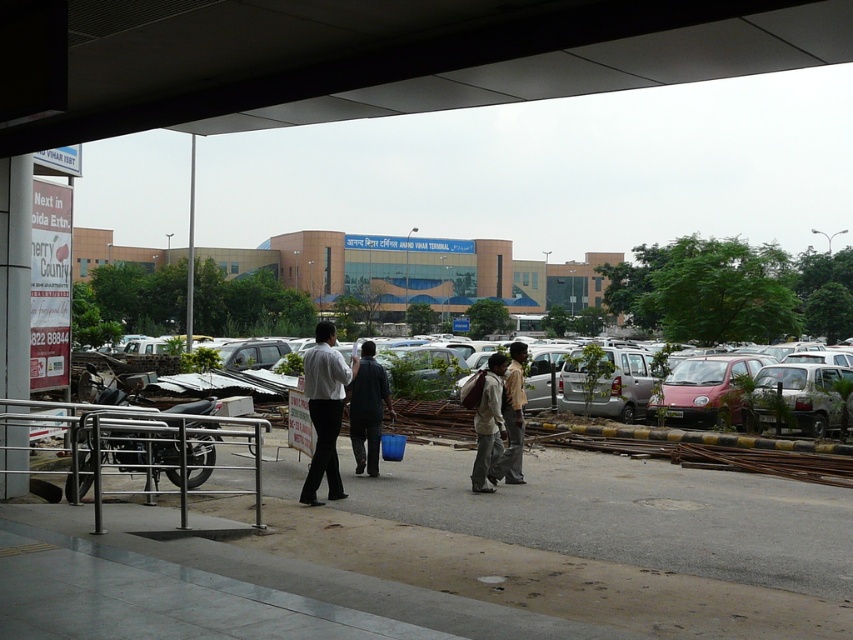
Does light brown fabric pants at center have a smaller size compared to dark blue shirt at center?

No, light brown fabric pants at center is not smaller than dark blue shirt at center.

In the scene shown: How much distance is there between light brown fabric pants at center and dark blue shirt at center?

A distance of 5.65 feet exists between light brown fabric pants at center and dark blue shirt at center.

This screenshot has height=640, width=853. What are the coordinates of `light brown fabric pants at center` in the screenshot? It's located at (500, 420).

This screenshot has height=640, width=853. In order to click on light brown fabric pants at center in this screenshot , I will do `click(500, 420)`.

Which is behind, point (779, 12) or point (474, 422)?

Positioned behind is point (474, 422).

Who is positioned more to the left, black matte ceiling at upper center or light brown fabric pants at center?

Positioned to the left is black matte ceiling at upper center.

Where is `black matte ceiling at upper center`? The height and width of the screenshot is (640, 853). black matte ceiling at upper center is located at coordinates (368, 56).

The width and height of the screenshot is (853, 640). What are the coordinates of `black matte ceiling at upper center` in the screenshot? It's located at (368, 56).

The height and width of the screenshot is (640, 853). Find the location of `light brown fabric pants at center`. light brown fabric pants at center is located at coordinates (500, 420).

Locate an element on the screen. This screenshot has height=640, width=853. light brown fabric pants at center is located at coordinates (500, 420).